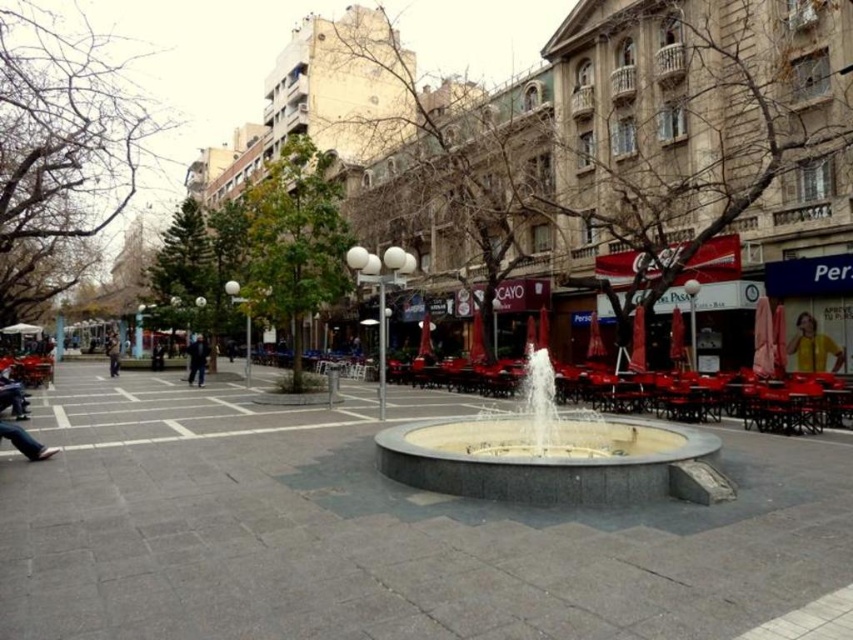
In the scene shown: Is smooth concrete fountain at center positioned in front of dark blue jacket at center?

Yes, it is.

Can you confirm if smooth concrete fountain at center is wider than dark blue jacket at center?

Yes.

Locate an element on the screen. The image size is (853, 640). smooth concrete fountain at center is located at coordinates (386, 531).

Where is `smooth concrete fountain at center`? Image resolution: width=853 pixels, height=640 pixels. smooth concrete fountain at center is located at coordinates (386, 531).

In the scene shown: Who is taller, white marble fountain at center or yellow fabric person at lower right?

With more height is yellow fabric person at lower right.

Between white marble fountain at center and yellow fabric person at lower right, which one appears on the left side from the viewer's perspective?

From the viewer's perspective, white marble fountain at center appears more on the left side.

Who is more distant from viewer, (387,435) or (813,332)?

The point (813,332) is more distant.

Locate an element on the screen. The image size is (853, 640). white marble fountain at center is located at coordinates (553, 454).

Who is lower down, dark blue jacket at center or dark blue jeans at left?

Positioned lower is dark blue jeans at left.

Does dark blue jacket at center have a larger size compared to dark blue jeans at left?

No, dark blue jacket at center is not bigger than dark blue jeans at left.

Does point (202, 369) lie behind point (108, 358)?

No, (202, 369) is closer to viewer.

Locate an element on the screen. dark blue jacket at center is located at coordinates (196, 358).